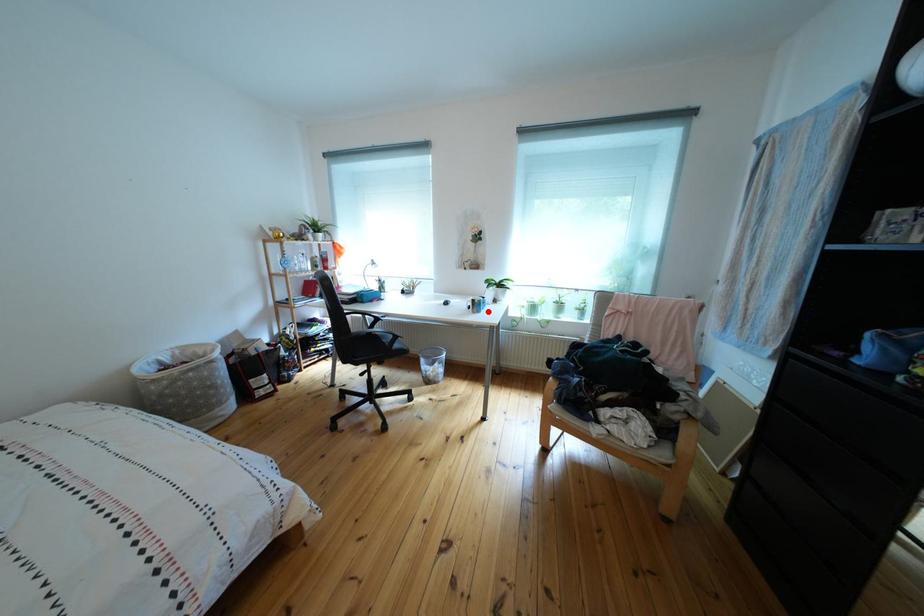
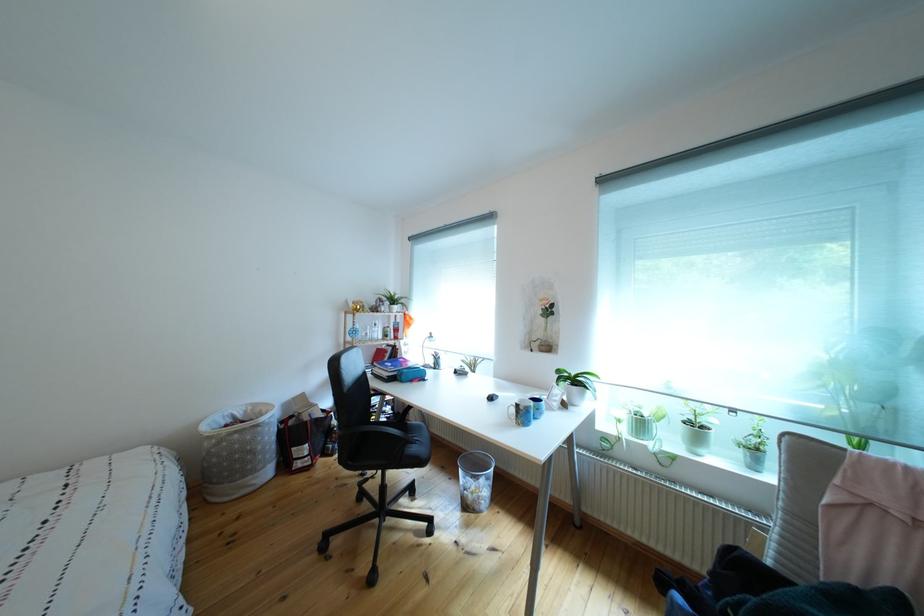
The point at the highlighted location is marked in the first image. Where is the corresponding point in the second image?

(533, 419)